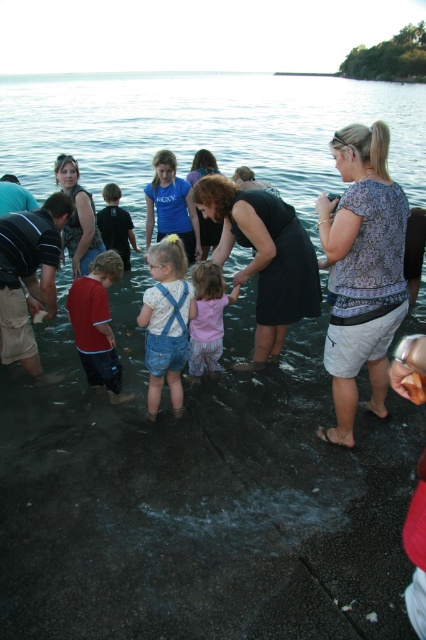
You are a photographer trying to capture a photo of the dark brown leather jacket at left and the red cotton shirt at center. Since you want both subjects to be in focus, you need to know if they are at the same height. Are they at the same height?

The dark brown leather jacket at left is located above the red cotton shirt at center, so they are not at the same height. The dark brown leather jacket at left is higher up than the red cotton shirt at center.

You are standing at the edge of the water and want to take a photo of the two points mentioned in the scene. Which point, point (388,278) or point (196,378), is closer to you?

Point (388,278) is closer to the camera than point (196,378), so it will appear closer to you in the photo.